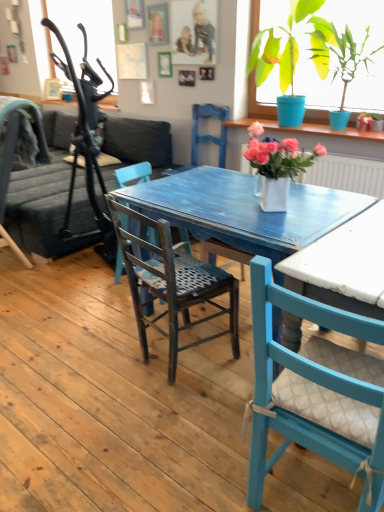
Question: Would you say white ceramic vase at center, which ranks as the 2th houseplant in top-to-bottom order, is outside dark gray fabric couch at left?

Choices:
 (A) yes
 (B) no

Answer: (A)

Question: Is white ceramic vase at center, the first houseplant when ordered from bottom to top, shorter than dark gray fabric couch at left?

Choices:
 (A) yes
 (B) no

Answer: (A)

Question: From a real-world perspective, is white ceramic vase at center, which ranks as the 2th houseplant in top-to-bottom order, beneath dark gray fabric couch at left?

Choices:
 (A) yes
 (B) no

Answer: (B)

Question: Is white ceramic vase at center, which ranks as the 2th houseplant in top-to-bottom order, further to camera compared to dark gray fabric couch at left?

Choices:
 (A) yes
 (B) no

Answer: (B)

Question: From the image's perspective, is white ceramic vase at center, marked as the second houseplant in a back-to-front arrangement, over dark gray fabric couch at left?

Choices:
 (A) yes
 (B) no

Answer: (B)

Question: From a real-world perspective, is wooden chair with patterned seat cushion at center, which appears as the 2th chair when viewed from the front, above or below dark blue fabric chair at left, which ranks as the first chair in left-to-right order?

Choices:
 (A) below
 (B) above

Answer: (A)

Question: From the image's perspective, is wooden chair with patterned seat cushion at center, which is counted as the 2th chair, starting from the right, positioned above or below dark blue fabric chair at left, the first chair positioned from the back?

Choices:
 (A) above
 (B) below

Answer: (B)

Question: Considering the positions of wooden chair with patterned seat cushion at center, which appears as the 2th chair when viewed from the front, and dark blue fabric chair at left, which ranks as the first chair in left-to-right order, in the image, is wooden chair with patterned seat cushion at center, which appears as the 2th chair when viewed from the front, bigger or smaller than dark blue fabric chair at left, which ranks as the first chair in left-to-right order,?

Choices:
 (A) small
 (B) big

Answer: (A)

Question: Do you think wooden chair with patterned seat cushion at center, which appears as the 2th chair when viewed from the front, is within dark blue fabric chair at left, the third chair viewed from the front, or outside of it?

Choices:
 (A) outside
 (B) inside

Answer: (A)

Question: From the image's perspective, is wooden chair with patterned seat cushion at center, which appears as the 2th chair when viewed from the front, located above or below blue wooden chair at center?

Choices:
 (A) above
 (B) below

Answer: (B)

Question: Considering the positions of point (150, 293) and point (208, 139), is point (150, 293) closer or farther from the camera than point (208, 139)?

Choices:
 (A) closer
 (B) farther

Answer: (A)

Question: Is wooden chair with patterned seat cushion at center, the 2th chair positioned from the left, taller or shorter than blue wooden chair at center?

Choices:
 (A) short
 (B) tall

Answer: (B)

Question: Is wooden chair with patterned seat cushion at center, the 2th chair positioned from the left, spatially inside blue wooden chair at center, or outside of it?

Choices:
 (A) inside
 (B) outside

Answer: (B)

Question: Is dark gray fabric couch at left taller or shorter than white ceramic vase at center, the first houseplant from the front?

Choices:
 (A) short
 (B) tall

Answer: (B)

Question: Considering the positions of dark gray fabric couch at left and white ceramic vase at center, which ranks as the 2th houseplant in top-to-bottom order, in the image, is dark gray fabric couch at left bigger or smaller than white ceramic vase at center, which ranks as the 2th houseplant in top-to-bottom order,?

Choices:
 (A) small
 (B) big

Answer: (B)